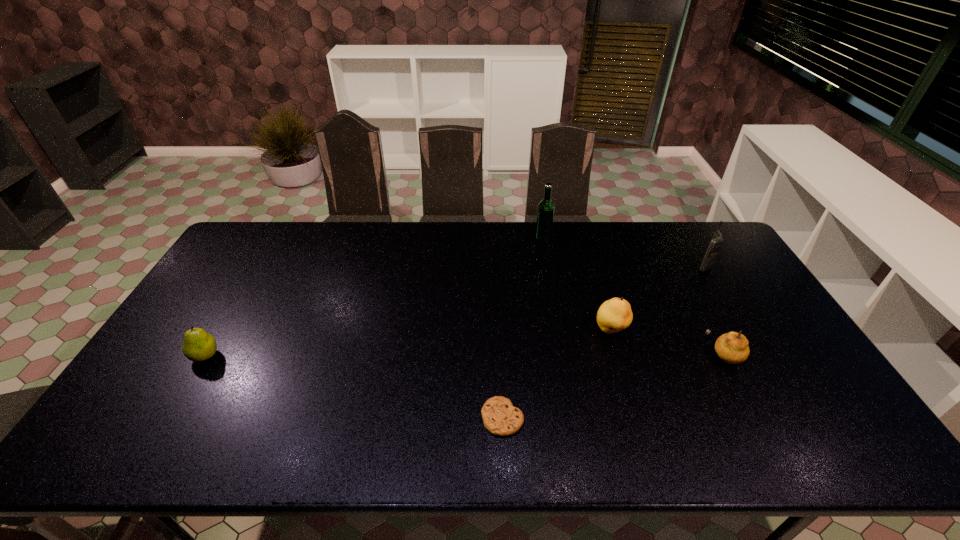
What are the coordinates of `vacant region located on the keyboard of the fifth shortest object` in the screenshot? It's located at (643, 266).

This screenshot has height=540, width=960. In order to click on vacant space located 0.310m on the keyboard of the fifth shortest object in this screenshot , I will do `click(605, 266)`.

Where is `free spot located 0.070m on the keyboard of the fifth shortest object`? The height and width of the screenshot is (540, 960). free spot located 0.070m on the keyboard of the fifth shortest object is located at coordinates (675, 266).

Locate an element on the screen. Image resolution: width=960 pixels, height=540 pixels. free region located 0.060m on the right of the second pear from right to left is located at coordinates (648, 330).

The image size is (960, 540). I want to click on vacant position located 0.220m on the back of the leftmost pear, so click(x=244, y=292).

The image size is (960, 540). What are the coordinates of `vacant space located 0.310m on the back of the rightmost pear` in the screenshot? It's located at (680, 270).

Where is `vacant space located 0.260m on the back of the shortest object`? The image size is (960, 540). vacant space located 0.260m on the back of the shortest object is located at coordinates (498, 323).

The width and height of the screenshot is (960, 540). What are the coordinates of `beer bottle situated at the far edge` in the screenshot? It's located at (545, 213).

Locate an element on the screen. The height and width of the screenshot is (540, 960). cellular telephone that is at the far edge is located at coordinates (717, 240).

Image resolution: width=960 pixels, height=540 pixels. Identify the location of object present at the near edge. (500, 417).